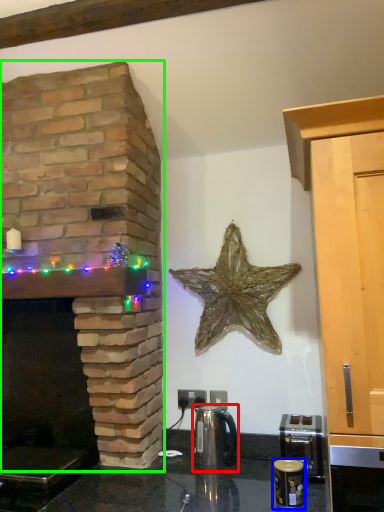
Question: Based on their relative distances, which object is nearer to tea pot (highlighted by a red box)? Choose from appliance (highlighted by a blue box) and fireplace (highlighted by a green box).

Choices:
 (A) appliance
 (B) fireplace

Answer: (A)